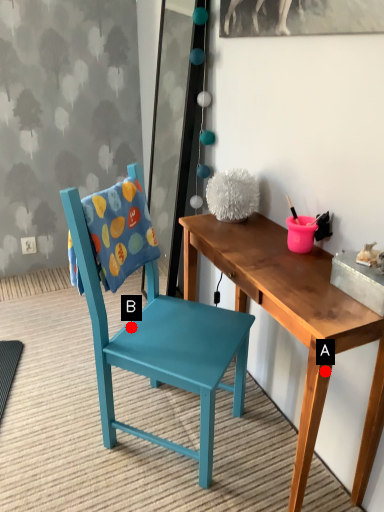
Question: Two points are circled on the image, labeled by A and B beside each circle. Which of the following is the closest to the observer?

Choices:
 (A) A is closer
 (B) B is closer

Answer: (A)